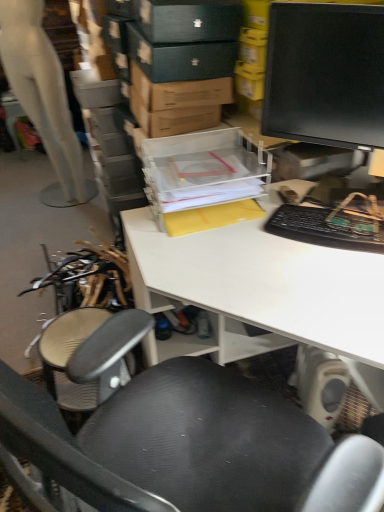
You are a GUI agent. You are given a task and a screenshot of the screen. Output one action in this format:
    pyautogui.click(x=<x>, y=<y>)
    Task: Click on the free space to the left of black plastic keyboard at right
    
    Given the screenshot: What is the action you would take?
    pyautogui.click(x=244, y=250)